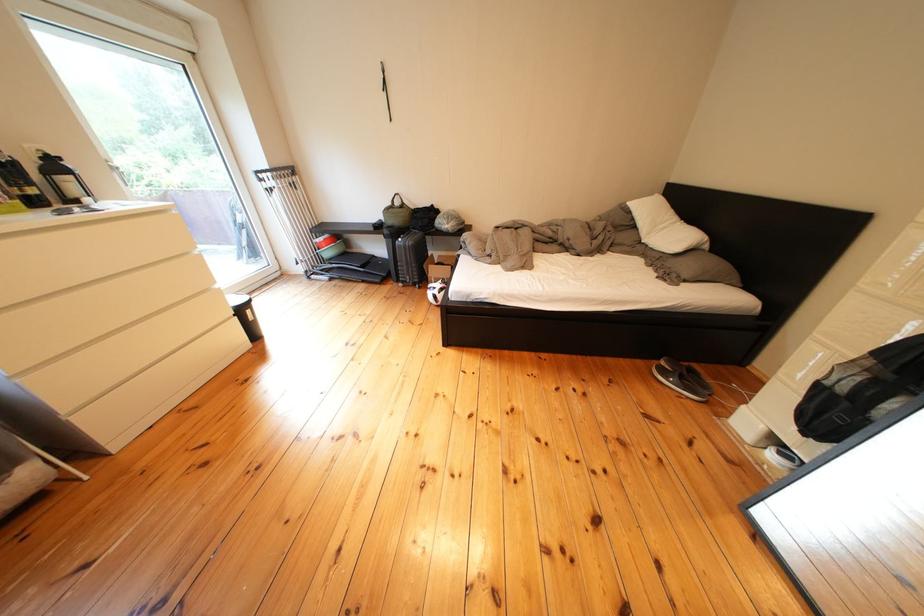
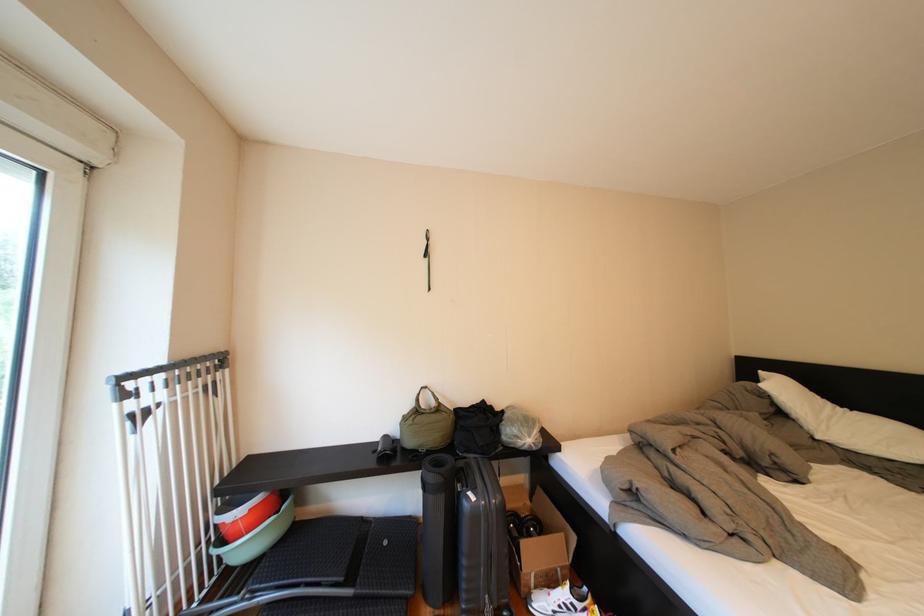
In the second image, find the point that corresponds to (x=342, y=257) in the first image.

(261, 551)